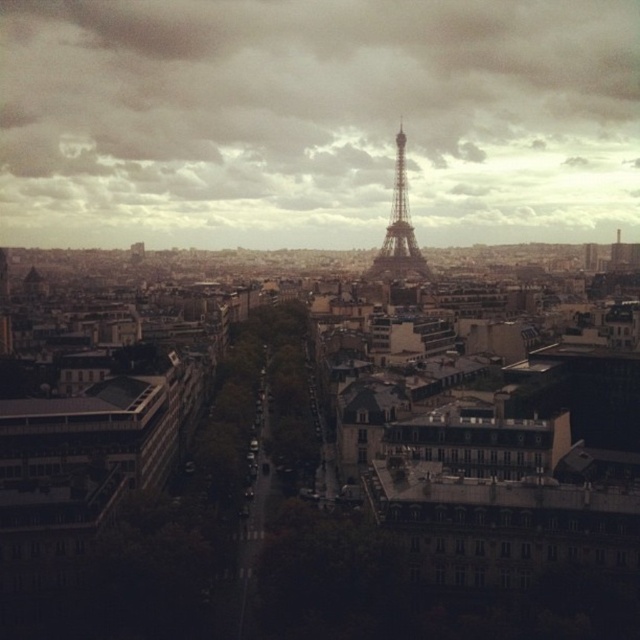
You are an architect analyzing the Paris skyline. You observe the cloudy sky at center and the shiny metallic tower at center. Which object is positioned to the left of the other?

The cloudy sky at center is to the left of the shiny metallic tower at center according to the description.

You are an architect designing a new building in Paris. You want to ensure that your building does not block the view of the Eiffel Tower from a central park. Given the position of the cloudy sky at center and the shiny metallic tower at center, which object should you consider in your design to maintain the tower visibility?

The cloudy sky at center is positioned over the shiny metallic tower at center, so to maintain visibility of the tower, the architect should ensure that the new building does not obstruct the line of sight to the shiny metallic tower at center, which is located below the cloudy sky at center.

You are a photographer planning to capture a wide shot of the Paris skyline. You notice the cloudy sky at center and the shiny metallic tower at center in your viewfinder. Based on their sizes in the image, which one would you focus on to ensure both fit comfortably within the frame?

The cloudy sky at center has a larger width than the shiny metallic tower at center, so focusing on the cloudy sky at center would allow both elements to fit comfortably within the frame.